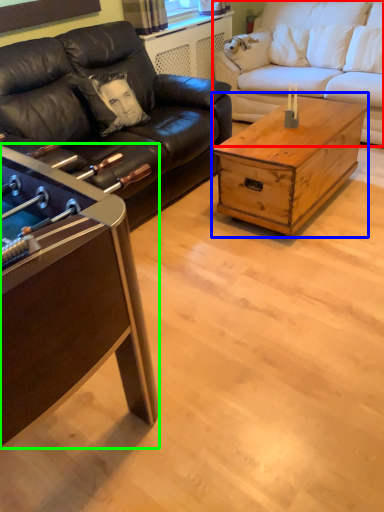
Question: Which object is positioned farthest from studio couch (highlighted by a red box)? Select from coffee table (highlighted by a blue box) and coffee table (highlighted by a green box).

Choices:
 (A) coffee table
 (B) coffee table

Answer: (B)